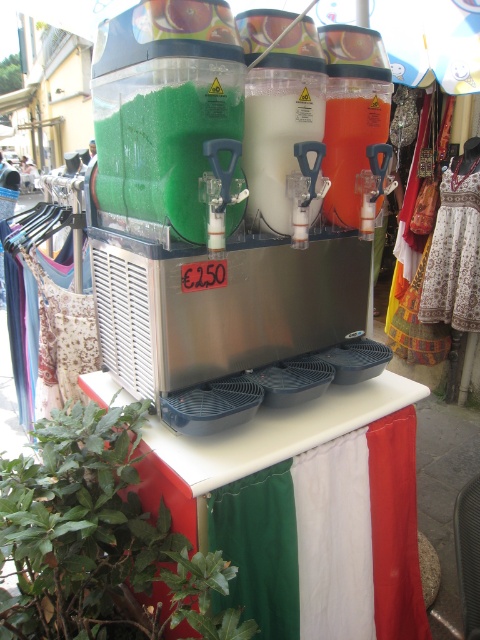
You are at the outdoor market and want to buy a slushy. The dispenser has three colors available. Where is the point at coordinates point (319, 499) located in relation to the white plastic table at center?

The point at coordinates point (319, 499) is located on the white plastic table at center.

You are at the market and want to buy a drink. You notice the green leafy plant at lower left and the white plastic milkshake at center. Which object is wider?

The green leafy plant at lower left might be wider than the white plastic milkshake at center.